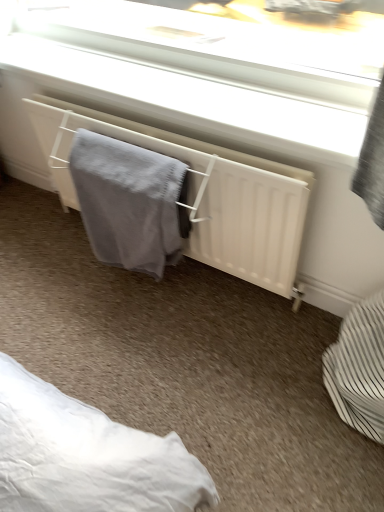
The width and height of the screenshot is (384, 512). I want to click on free spot above gray knitted towel at center (from a real-world perspective), so 128,155.